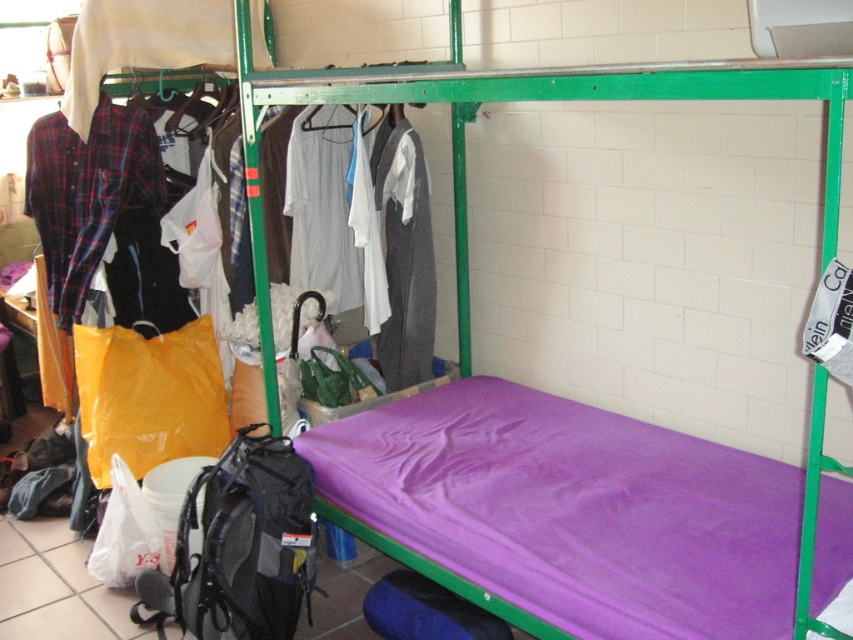
You need to hang a new shirt on the rack. The rack can only hold items up to the width of the white striped shirt at center. Can the plaid cotton shirt at left fit on the rack?

The plaid cotton shirt at left might be wider than the white striped shirt at center, so it might not fit on the rack.

You are standing at the point marked as point [383,525]. You need to move to the other side of the room. What is the minimum distance you must walk to reach the opposite wall?

The minimum distance you must walk is 2.17 meters.

You are organizing the dormitory and need to place a new item between the purple fabric mattress at lower center and the dark gray wool sweater at center. Where should you place it to ensure it is between them?

Since the purple fabric mattress at lower center is on the right side of the dark gray wool sweater at center, you should place the new item to the left of the purple fabric mattress at lower center and to the right of the dark gray wool sweater at center to position it between them.